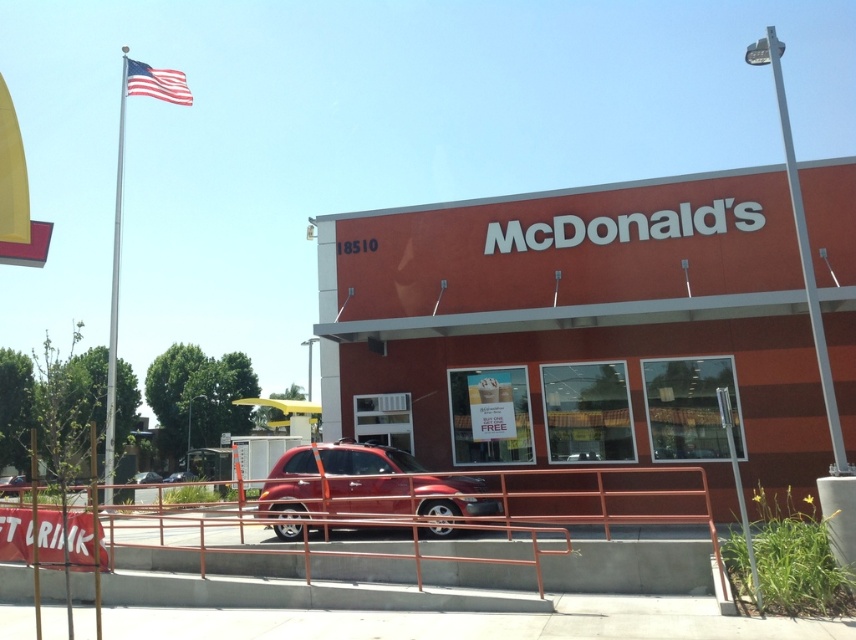
Question: Which of the following is the farthest from the observer?

Choices:
 (A) (426, 476)
 (B) (152, 472)

Answer: (B)

Question: Is silver metallic pole at upper right wider than american flag at upper left?

Choices:
 (A) yes
 (B) no

Answer: (A)

Question: Where is silver metallic flag pole at left located in relation to american flag at upper left in the image?

Choices:
 (A) right
 (B) left

Answer: (B)

Question: Considering the real-world distances, which object is farthest from the american flag at upper left?

Choices:
 (A) silver metallic pole at upper right
 (B) metallic red suv at center
 (C) metallic red suv at lower center

Answer: (A)

Question: Can you confirm if silver metallic pole at upper right is thinner than metallic red suv at lower center?

Choices:
 (A) yes
 (B) no

Answer: (B)

Question: Which object appears farthest from the camera in this image?

Choices:
 (A) shiny red suv at center
 (B) metallic red suv at center
 (C) silver metallic flag pole at left

Answer: (B)